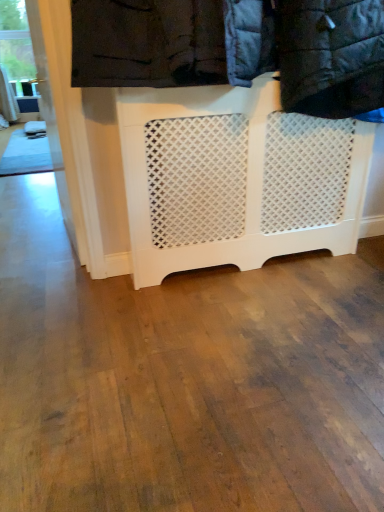
You are a GUI agent. You are given a task and a screenshot of the screen. Output one action in this format:
    pyautogui.click(x=<x>, y=<y>)
    Task: Click on the blank area beneath white lattice laundry at upper center (from a real-world perspective)
    The height and width of the screenshot is (512, 384).
    Given the screenshot: What is the action you would take?
    pyautogui.click(x=258, y=286)